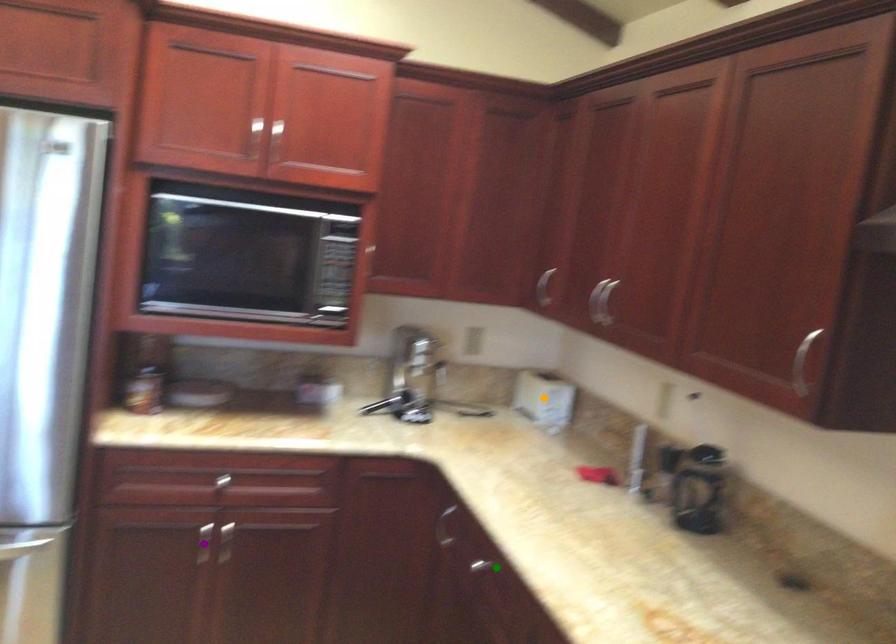
Order these from nearest to farthest:
A) green point
B) purple point
C) orange point

orange point
purple point
green point